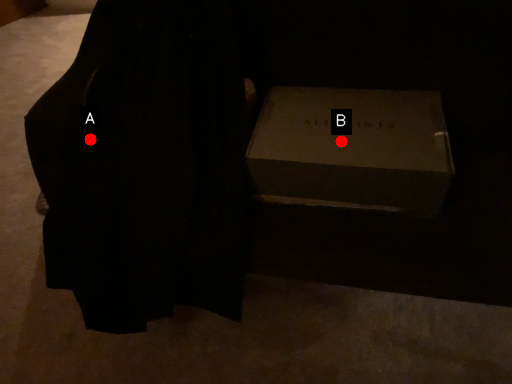
Question: Two points are circled on the image, labeled by A and B beside each circle. Which of the following is the closest to the observer?

Choices:
 (A) A is closer
 (B) B is closer

Answer: (B)